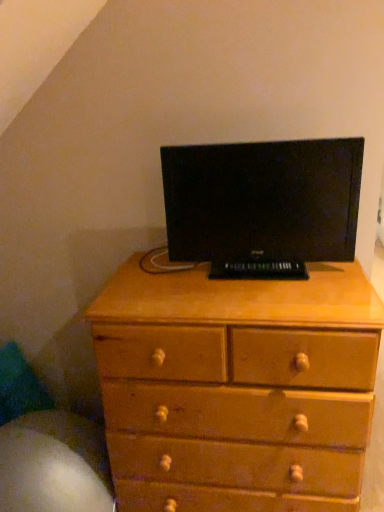
Question: Is light brown wood chest of drawers at center to the left or to the right of black matte computer monitor at center in the image?

Choices:
 (A) right
 (B) left

Answer: (B)

Question: In terms of size, does light brown wood chest of drawers at center appear bigger or smaller than black matte computer monitor at center?

Choices:
 (A) big
 (B) small

Answer: (A)

Question: Considering their positions, is light brown wood chest of drawers at center located in front of or behind black matte computer monitor at center?

Choices:
 (A) front
 (B) behind

Answer: (A)

Question: Relative to light brown wood chest of drawers at center, is black matte computer monitor at center in front or behind?

Choices:
 (A) behind
 (B) front

Answer: (A)

Question: From the image's perspective, is black matte computer monitor at center positioned above or below light brown wood chest of drawers at center?

Choices:
 (A) above
 (B) below

Answer: (A)

Question: Would you say black matte computer monitor at center is to the left or to the right of light brown wood chest of drawers at center in the picture?

Choices:
 (A) left
 (B) right

Answer: (B)

Question: Considering the positions of black matte computer monitor at center and light brown wood chest of drawers at center in the image, is black matte computer monitor at center bigger or smaller than light brown wood chest of drawers at center?

Choices:
 (A) small
 (B) big

Answer: (A)